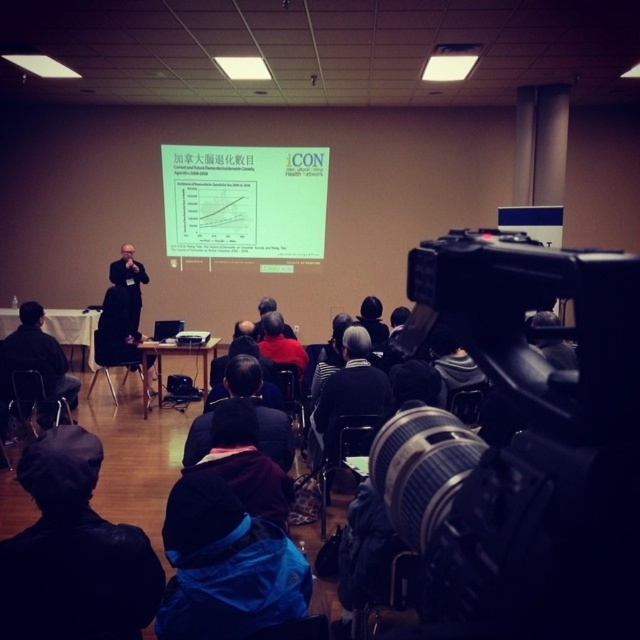
Which is more to the left, white paper at center or black matte suit at center?

Positioned to the left is black matte suit at center.

Who is more forward, (269, 230) or (138, 291)?

Positioned in front is point (138, 291).

In order to click on white paper at center in this screenshot , I will do `click(244, 202)`.

Is the position of blue fabric jacket at lower center more distant than that of black matte suit at center?

That is False.

Who is lower down, blue fabric jacket at lower center or black matte suit at center?

Positioned lower is blue fabric jacket at lower center.

Who is more distant from viewer, (180, 561) or (136, 317)?

Point (136, 317)

Where is `blue fabric jacket at lower center`? The width and height of the screenshot is (640, 640). blue fabric jacket at lower center is located at coordinates coord(225,566).

Is point (180, 182) less distant than point (371, 316)?

No, it is behind (371, 316).

Which is above, white paper at center or dark gray knit cap at center?

white paper at center

Who is more distant from viewer, (262, 198) or (358, 320)?

Positioned behind is point (262, 198).

Identify the location of white paper at center. (244, 202).